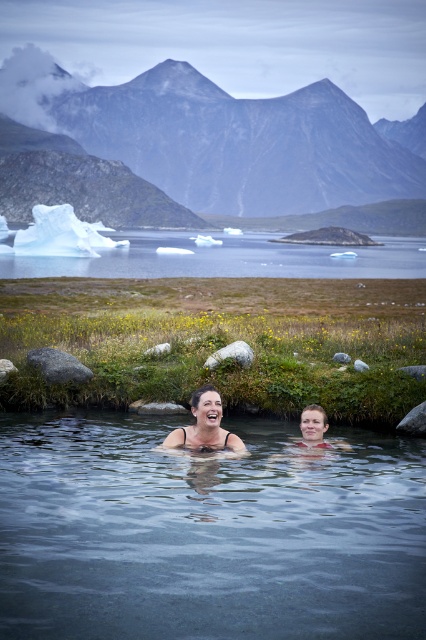
Based on the scene description, which object is positioned higher in the image? The smooth skin couple at center or the smooth skin woman at center?

The smooth skin couple at center is positioned higher than the smooth skin woman at center according to the description.

You are a photographer planning to capture the clear water at center and the smooth skin couple at center in a single shot. Based on their positions, which object should you focus on first to ensure both are in sharp focus?

The clear water at center is taller than the smooth skin couple at center, so you should focus on the clear water at center first to ensure both are in sharp focus.